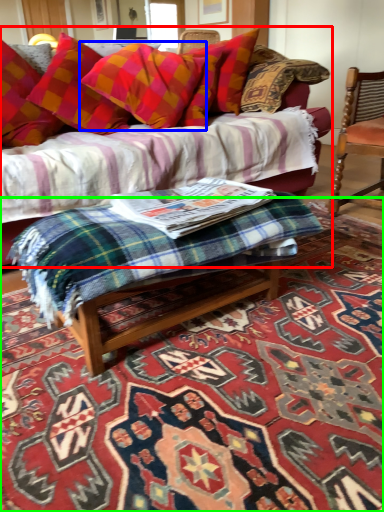
Question: Considering the real-world distances, which object is closest to studio couch (highlighted by a red box)? pillow (highlighted by a blue box) or mat (highlighted by a green box).

Choices:
 (A) pillow
 (B) mat

Answer: (A)